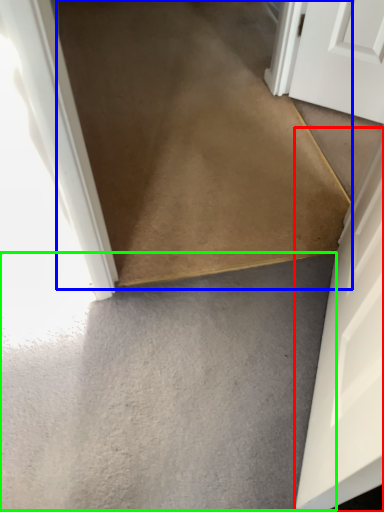
Question: Which is farther away from door (highlighted by a red box)? path (highlighted by a blue box) or concrete (highlighted by a green box)?

Choices:
 (A) path
 (B) concrete

Answer: (A)